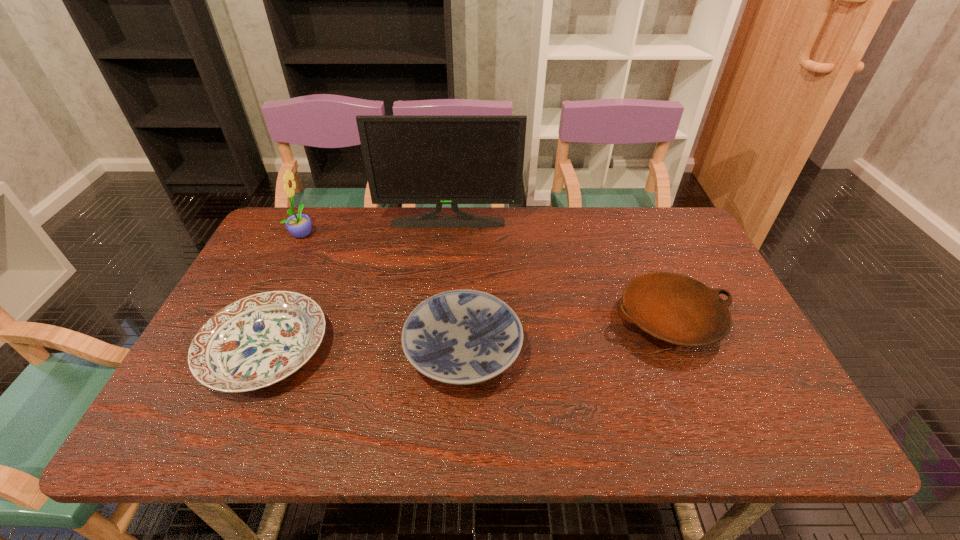
Image resolution: width=960 pixels, height=540 pixels. I want to click on free space that satisfies the following two spatial constraints: 1. on the front-facing side of the second tallest object; 2. on the left side of the rightmost plate, so click(261, 320).

This screenshot has width=960, height=540. Find the location of `blank area in the image that satisfies the following two spatial constraints: 1. on the front-facing side of the rightmost object; 2. on the left side of the tallest object`. blank area in the image that satisfies the following two spatial constraints: 1. on the front-facing side of the rightmost object; 2. on the left side of the tallest object is located at coordinates (439, 320).

The height and width of the screenshot is (540, 960). Identify the location of vacant area in the image that satisfies the following two spatial constraints: 1. on the front-facing side of the monitor; 2. on the front-facing side of the sunflower. click(x=446, y=233).